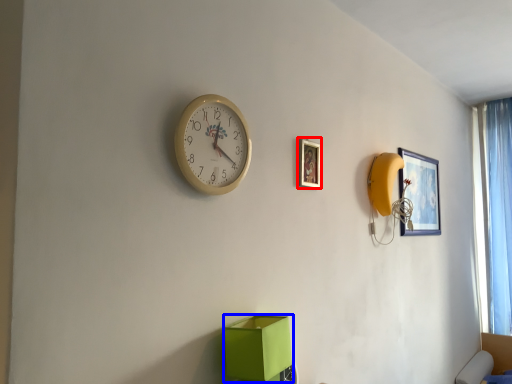
Question: Among these objects, which one is nearest to the camera, picture frame (highlighted by a red box) or cardboard box (highlighted by a blue box)?

Choices:
 (A) picture frame
 (B) cardboard box

Answer: (B)